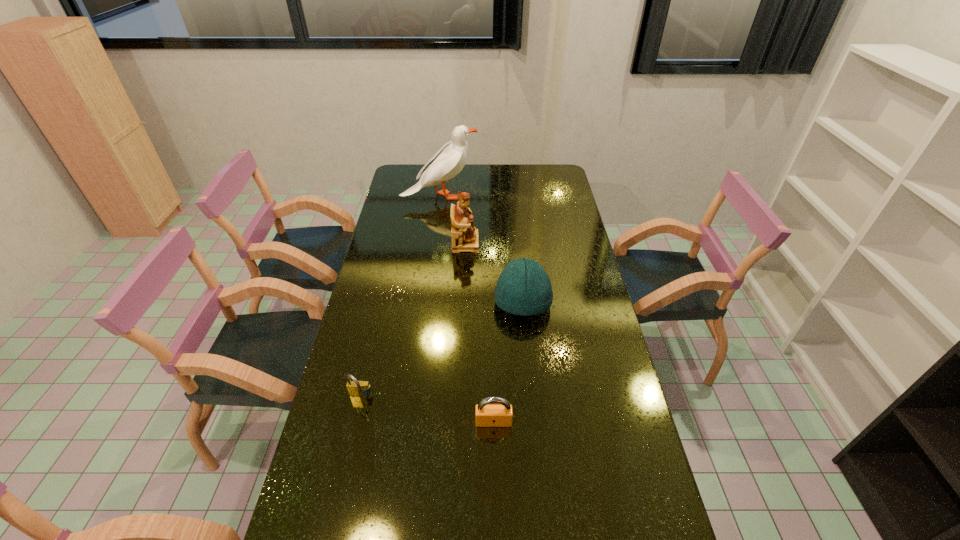
Locate an element on the screen. The width and height of the screenshot is (960, 540). vacant space at the left edge of the desktop is located at coordinates (413, 242).

Identify the location of free spot at the right edge of the desktop. (568, 263).

Image resolution: width=960 pixels, height=540 pixels. In the image, there is a desktop. Identify the location of vacant space at the far right corner. (553, 181).

The height and width of the screenshot is (540, 960). I want to click on free space between the beanie and the nearer padlock, so click(508, 362).

This screenshot has height=540, width=960. Identify the location of free space between the nearest object and the third farthest object. (508, 362).

Locate an element on the screen. vacant area between the nearer padlock and the farthest object is located at coordinates (467, 309).

The height and width of the screenshot is (540, 960). I want to click on vacant space that's between the tallest object and the third nearest object, so click(x=482, y=249).

Locate an element on the screen. object that ranks as the third closest to the fourth shortest object is located at coordinates (356, 388).

Find the location of a particular element. This screenshot has height=540, width=960. object identified as the fourth closest to the left padlock is located at coordinates pyautogui.click(x=450, y=159).

Identify the location of free location that satisfies the following two spatial constraints: 1. on the back side of the beanie; 2. on the front-facing side of the second tallest object. (516, 243).